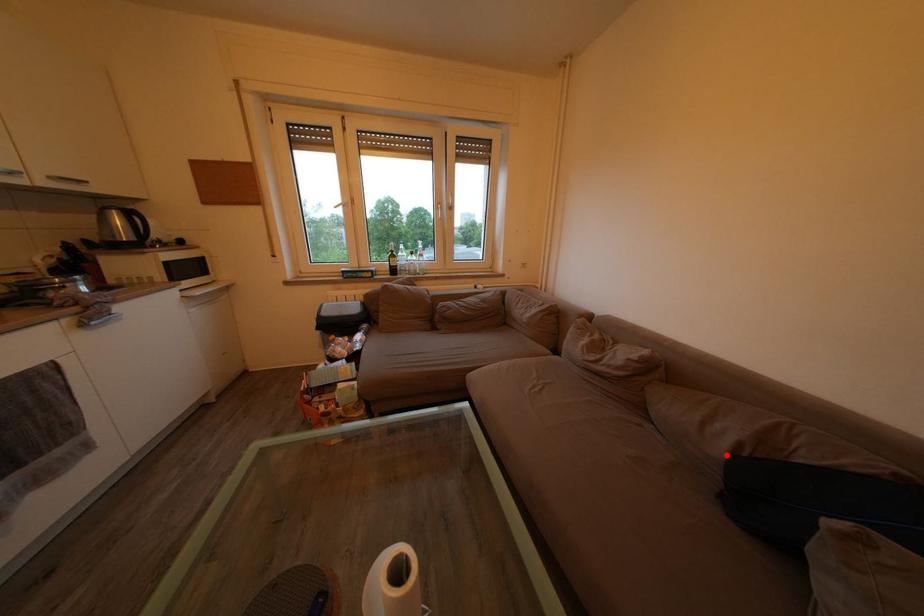
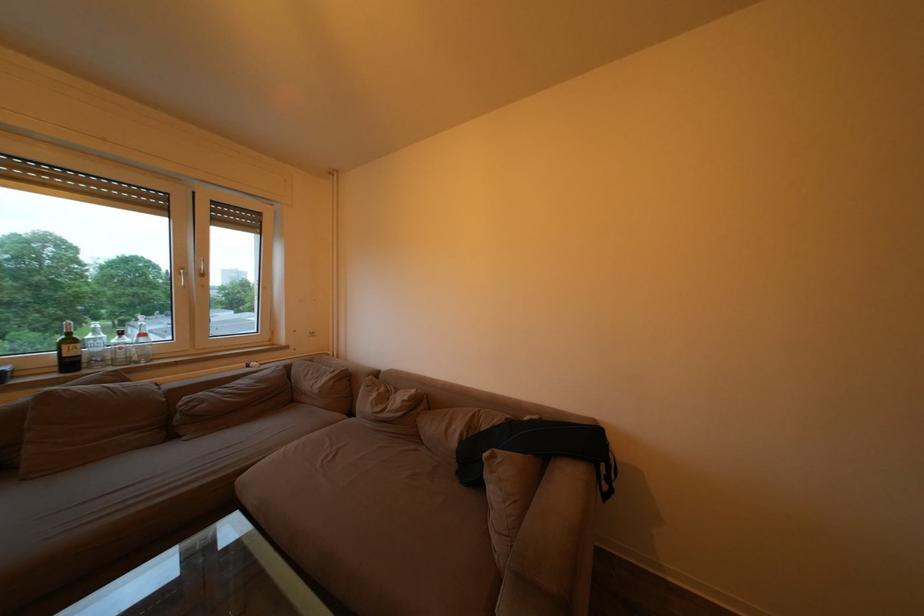
Question: I am providing you with two images of the same scene from different viewpoints. In image1, a red point is highlighted. Considering the same 3D point in image2, which of the following is correct?

Choices:
 (A) It is closer
 (B) It is farther

Answer: (B)